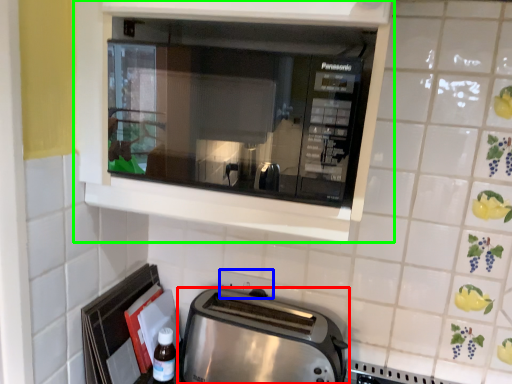
Question: Considering the real-world distances, which object is closest to toaster (highlighted by a red box)? electric outlet (highlighted by a blue box) or cabinetry (highlighted by a green box).

Choices:
 (A) electric outlet
 (B) cabinetry

Answer: (A)